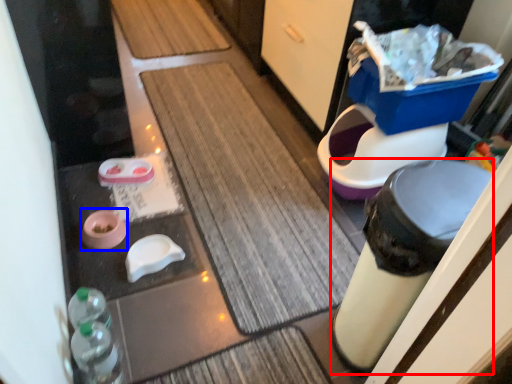
Question: Among these objects, which one is farthest to the camera, trash bin/can (highlighted by a red box) or potty (highlighted by a blue box)?

Choices:
 (A) trash bin/can
 (B) potty

Answer: (B)